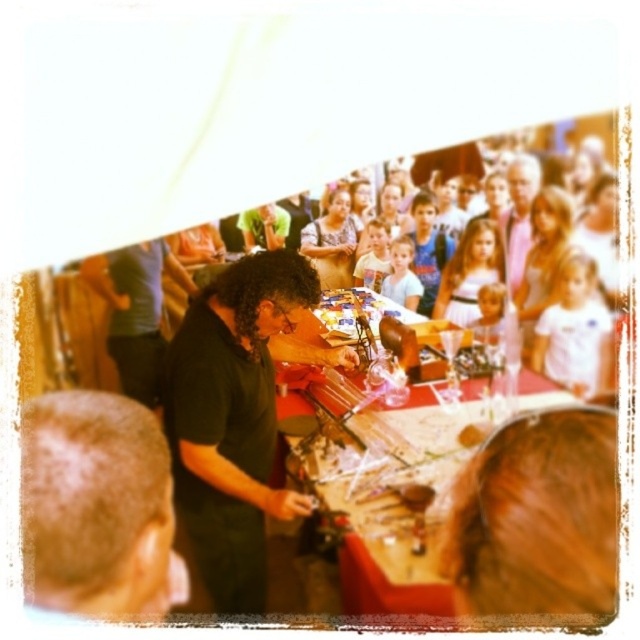
Question: Can you confirm if black matte shirt at center is thinner than matte gray shirt at upper center?

Choices:
 (A) no
 (B) yes

Answer: (A)

Question: Which object appears closest to the camera in this image?

Choices:
 (A) matte gray shirt at upper center
 (B) black matte shirt at center

Answer: (A)

Question: Which of the following is the farthest from the observer?

Choices:
 (A) (224, 556)
 (B) (528, 228)
 (C) (109, 429)

Answer: (A)

Question: Which point appears closest to the camera in this image?

Choices:
 (A) (212, 330)
 (B) (524, 234)
 (C) (122, 516)

Answer: (C)

Question: Is the position of gray hair at lower left less distant than that of matte gray shirt at upper center?

Choices:
 (A) yes
 (B) no

Answer: (A)

Question: Where is black matte shirt at center located in relation to gray hair at lower left in the image?

Choices:
 (A) below
 (B) above

Answer: (B)